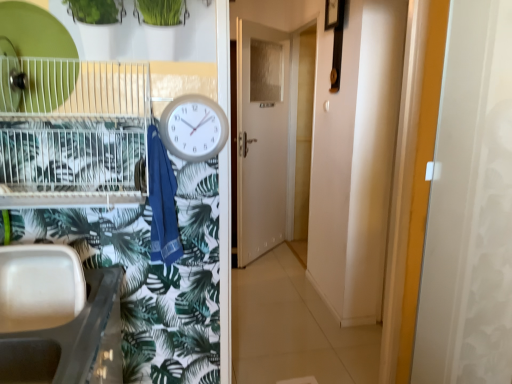
Question: From the image's perspective, is white plastic sink at lower left on white glossy door at center?

Choices:
 (A) yes
 (B) no

Answer: (B)

Question: From the image's perspective, would you say white plastic sink at lower left is shown under white glossy door at center?

Choices:
 (A) yes
 (B) no

Answer: (A)

Question: Is white plastic sink at lower left smaller than white glossy door at center?

Choices:
 (A) yes
 (B) no

Answer: (A)

Question: Does white plastic sink at lower left turn towards white glossy door at center?

Choices:
 (A) yes
 (B) no

Answer: (B)

Question: Considering the relative sizes of white plastic sink at lower left and white glossy door at center in the image provided, is white plastic sink at lower left bigger than white glossy door at center?

Choices:
 (A) no
 (B) yes

Answer: (A)

Question: Is point (194, 109) positioned closer to the camera than point (241, 46)?

Choices:
 (A) farther
 (B) closer

Answer: (B)

Question: Considering the positions of white plastic clock at center and white glossy door at center in the image, is white plastic clock at center wider or thinner than white glossy door at center?

Choices:
 (A) wide
 (B) thin

Answer: (B)

Question: From the image's perspective, is white plastic clock at center positioned above or below white glossy door at center?

Choices:
 (A) above
 (B) below

Answer: (B)

Question: Based on their positions, is white plastic clock at center located to the left or right of white glossy door at center?

Choices:
 (A) left
 (B) right

Answer: (A)

Question: From a real-world perspective, is white glossy screen door at right positioned above or below white glossy door at center?

Choices:
 (A) below
 (B) above

Answer: (B)

Question: Looking at the image, does white glossy screen door at right seem bigger or smaller compared to white glossy door at center?

Choices:
 (A) big
 (B) small

Answer: (B)

Question: Considering the positions of white glossy screen door at right and white glossy door at center in the image, is white glossy screen door at right taller or shorter than white glossy door at center?

Choices:
 (A) tall
 (B) short

Answer: (B)

Question: Is white glossy screen door at right situated inside white glossy door at center or outside?

Choices:
 (A) inside
 (B) outside

Answer: (B)

Question: Choose the correct answer: Is metallic wire birdcage at left inside white glossy door at center or outside it?

Choices:
 (A) outside
 (B) inside

Answer: (A)

Question: In terms of width, does metallic wire birdcage at left look wider or thinner when compared to white glossy door at center?

Choices:
 (A) wide
 (B) thin

Answer: (A)